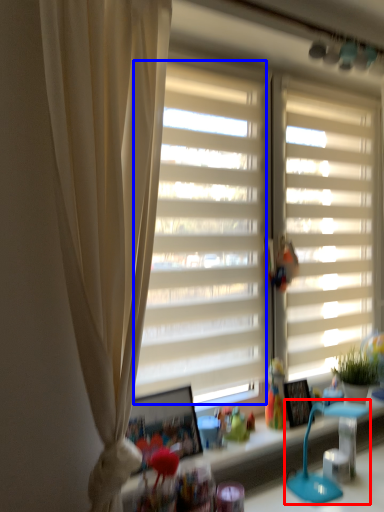
Question: Which point is further to the camera, table lamp (highlighted by a red box) or window screen (highlighted by a blue box)?

Choices:
 (A) table lamp
 (B) window screen

Answer: (B)